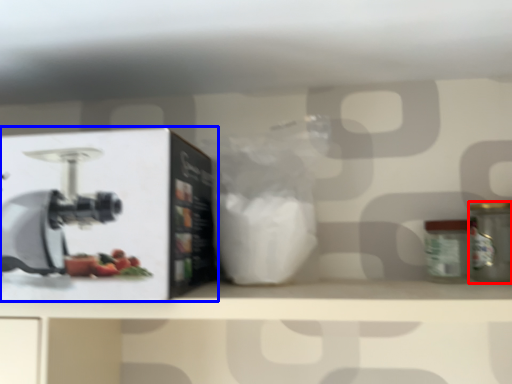
Question: Which object is closer to the camera taking this photo, kitchen appliance (highlighted by a red box) or wide (highlighted by a blue box)?

Choices:
 (A) kitchen appliance
 (B) wide

Answer: (B)